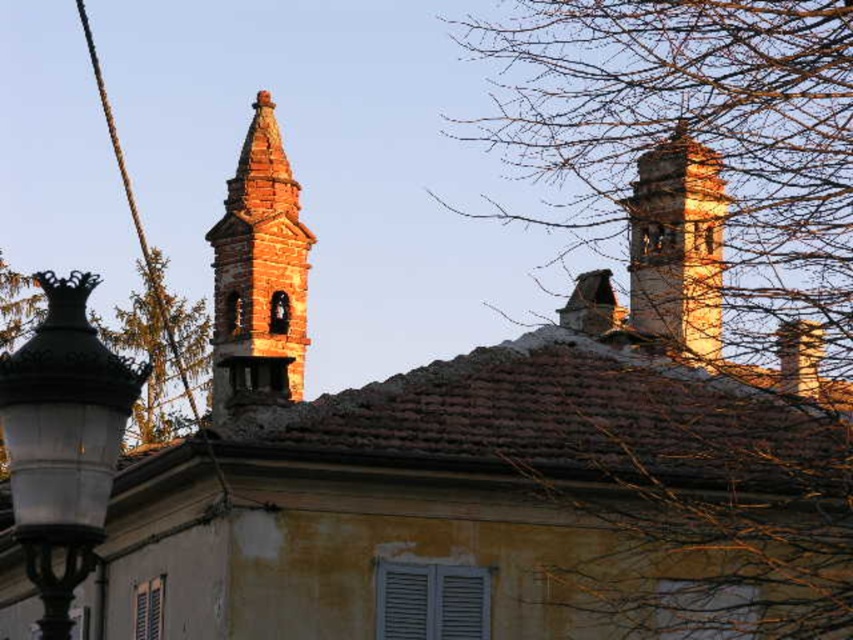
Question: Is bare branches at upper center further to camera compared to rustic stone bell tower at upper left?

Choices:
 (A) no
 (B) yes

Answer: (A)

Question: Considering the relative positions of bare branches at upper center and green leafy tree at upper left in the image provided, where is bare branches at upper center located with respect to green leafy tree at upper left?

Choices:
 (A) left
 (B) right

Answer: (B)

Question: Observing the image, what is the correct spatial positioning of bare branches at upper center in reference to brown stone tower at upper right?

Choices:
 (A) below
 (B) above

Answer: (B)

Question: Among these objects, which one is nearest to the camera?

Choices:
 (A) rustic stone bell tower at upper left
 (B) black wrought iron lamp post at left
 (C) rope at left

Answer: (B)

Question: Which point is farther to the camera?

Choices:
 (A) black wrought iron lamp post at left
 (B) green leafy tree at upper left

Answer: (B)

Question: Estimate the real-world distances between objects in this image. Which object is closer to the brown stone tower at upper right?

Choices:
 (A) green leafy tree at upper left
 (B) rope at left

Answer: (B)